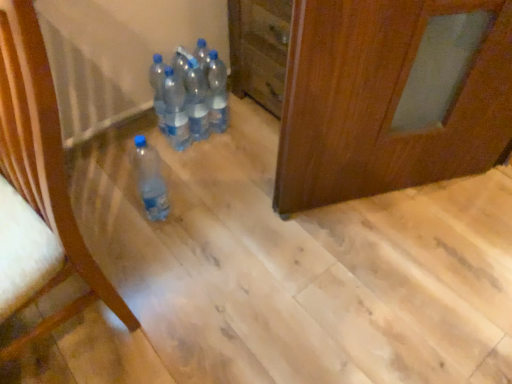
Identify the location of free space between translucent plastic bottle at lower left, acting as the 4th bottle starting from the right, and transparent plastic bottles at center, placed as the 5th bottle when sorted from left to right. (190, 168).